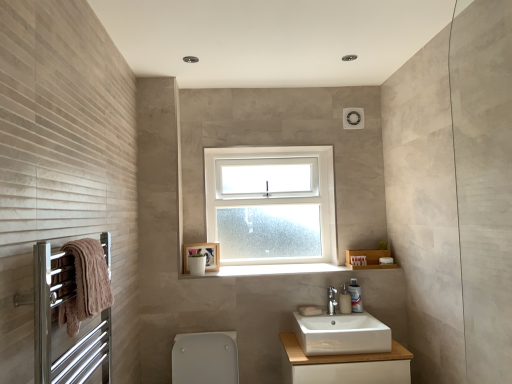
Question: Is white glossy toilet bowl at lower center to the left of white glossy cabinet at lower center from the viewer's perspective?

Choices:
 (A) no
 (B) yes

Answer: (B)

Question: Does white glossy toilet bowl at lower center have a greater height compared to white glossy cabinet at lower center?

Choices:
 (A) yes
 (B) no

Answer: (A)

Question: Is white glossy toilet bowl at lower center oriented towards white glossy cabinet at lower center?

Choices:
 (A) yes
 (B) no

Answer: (B)

Question: Is white glossy toilet bowl at lower center wider than white glossy cabinet at lower center?

Choices:
 (A) no
 (B) yes

Answer: (B)

Question: From the image's perspective, is white glossy toilet bowl at lower center beneath white glossy cabinet at lower center?

Choices:
 (A) yes
 (B) no

Answer: (B)

Question: Does white glossy toilet bowl at lower center lie in front of white glossy cabinet at lower center?

Choices:
 (A) yes
 (B) no

Answer: (A)

Question: Is the position of brown towel at left more distant than that of white glossy soap dispenser at lower center?

Choices:
 (A) yes
 (B) no

Answer: (B)

Question: Would you say brown towel at left is outside white glossy soap dispenser at lower center?

Choices:
 (A) no
 (B) yes

Answer: (B)

Question: Does brown towel at left have a greater width compared to white glossy soap dispenser at lower center?

Choices:
 (A) yes
 (B) no

Answer: (A)

Question: Could you tell me if brown towel at left is facing white glossy soap dispenser at lower center?

Choices:
 (A) yes
 (B) no

Answer: (B)

Question: Is brown towel at left touching white glossy soap dispenser at lower center?

Choices:
 (A) no
 (B) yes

Answer: (A)

Question: Could white glossy soap dispenser at lower center be considered to be inside brown towel at left?

Choices:
 (A) no
 (B) yes

Answer: (A)

Question: Can white glossy soap dispenser at lower right be found inside white ceramic sink at center?

Choices:
 (A) no
 (B) yes

Answer: (B)